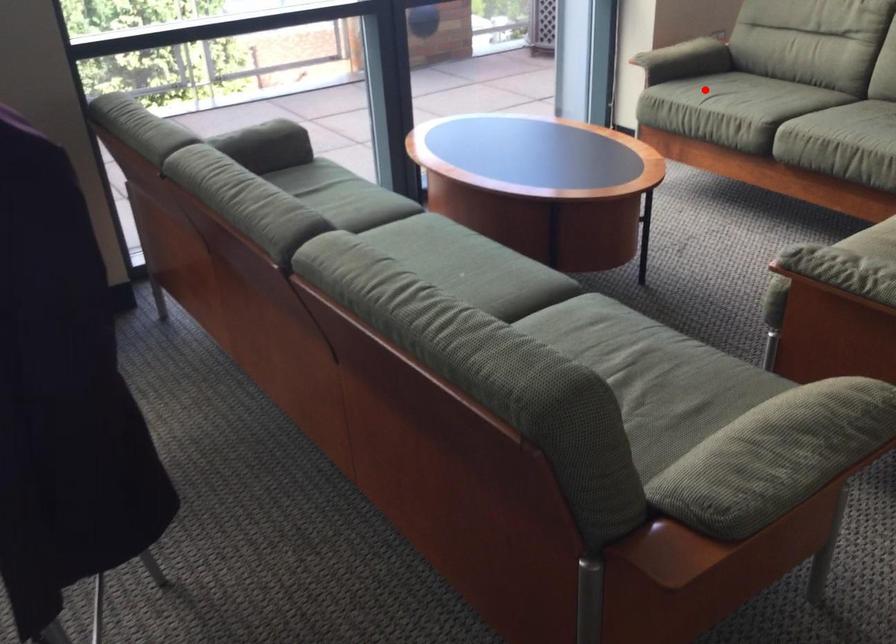
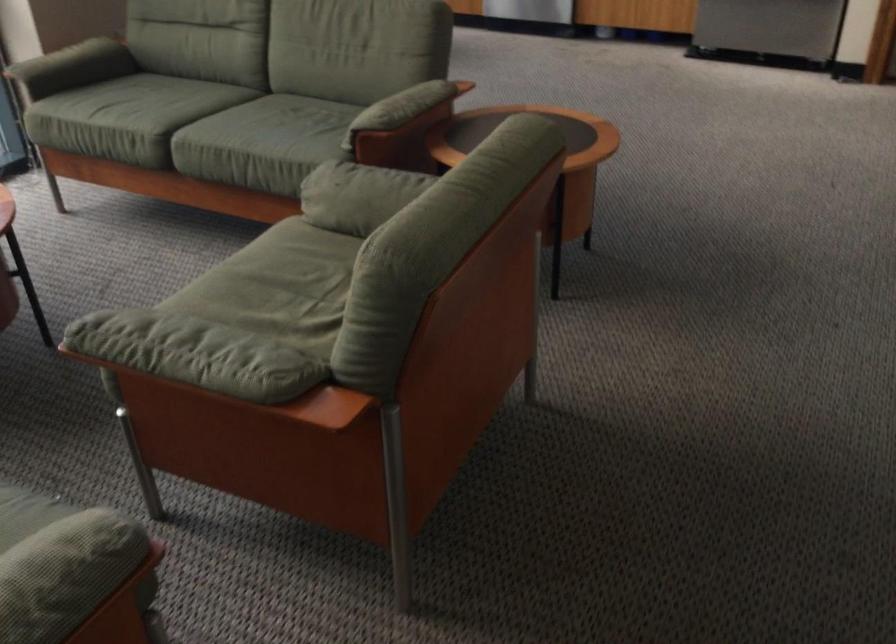
Question: I am providing you with two images of the same scene from different viewpoints. In image1, a red point is highlighted. Considering the same 3D point in image2, which of the following is correct?

Choices:
 (A) It is closer
 (B) It is farther

Answer: (A)